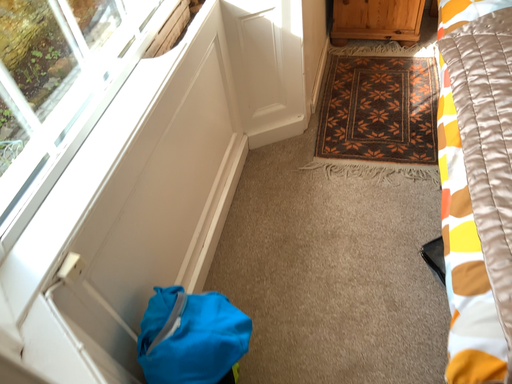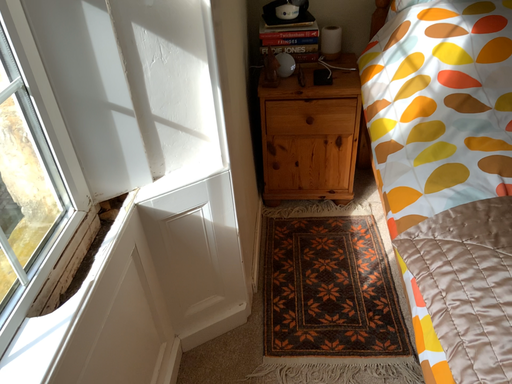
Question: How did the camera likely rotate when shooting the video?

Choices:
 (A) rotated upward
 (B) rotated downward

Answer: (A)